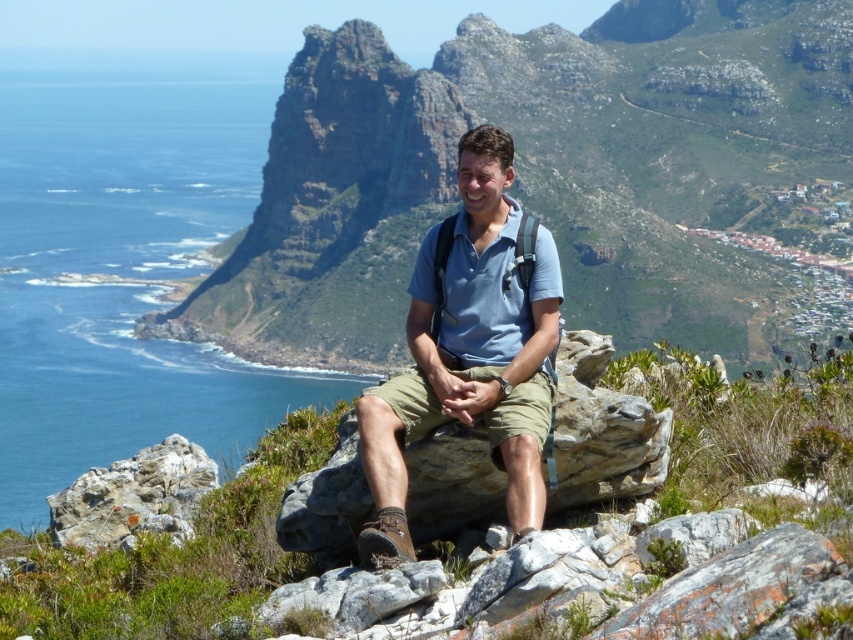
Who is more distant from viewer, [476,246] or [131,504]?

The point [131,504] is more distant.

Does blue cotton shirt at center appear on the left side of rough textured rock at lower left?

No, blue cotton shirt at center is not to the left of rough textured rock at lower left.

Does point (459, 344) come behind point (120, 502)?

No, (459, 344) is in front of (120, 502).

The height and width of the screenshot is (640, 853). Find the location of `blue cotton shirt at center`. blue cotton shirt at center is located at coordinates (471, 349).

Does rugged rock formation at center have a lesser width compared to blue cotton shirt at center?

Incorrect, rugged rock formation at center's width is not less than blue cotton shirt at center's.

Describe the element at coordinates (553, 179) in the screenshot. The image size is (853, 640). I see `rugged rock formation at center` at that location.

I want to click on rugged rock formation at center, so click(x=553, y=179).

Where is `rugged rock formation at center`? rugged rock formation at center is located at coordinates (553, 179).

Measure the distance between rugged rock formation at center and blue water at left.

A distance of 343.46 feet exists between rugged rock formation at center and blue water at left.

Which is more to the left, rugged rock formation at center or blue water at left?

blue water at left is more to the left.

Locate an element on the screen. This screenshot has height=640, width=853. rugged rock formation at center is located at coordinates (553, 179).